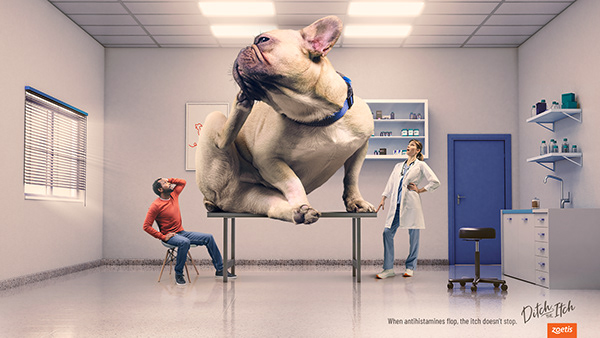
Locate an element on the screen. Image resolution: width=600 pixels, height=338 pixels. desk is located at coordinates (514, 231).